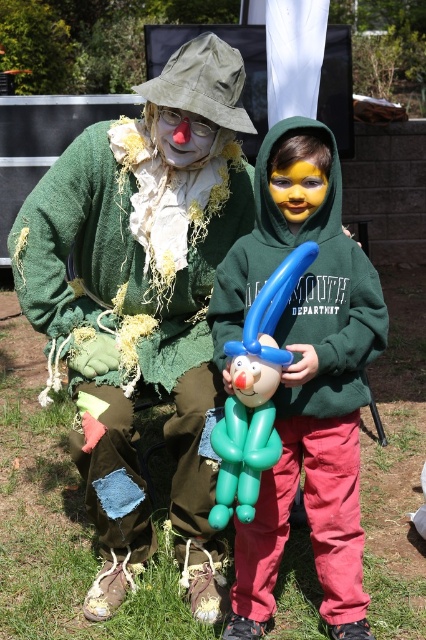
The width and height of the screenshot is (426, 640). In order to click on matte green hoodie at center in this screenshot , I will do `click(305, 388)`.

Which is in front, point (322, 502) or point (261, 403)?

Point (261, 403)

Consider the image. Measure the distance between point (267, 515) and camera.

Point (267, 515) and camera are 7.77 feet apart.

Identify the location of matte green hoodie at center. The width and height of the screenshot is (426, 640). (305, 388).

Measure the distance between point (x=293, y=417) and camera.

The distance of point (x=293, y=417) from camera is 2.31 meters.

Does point (347, 592) come farther from viewer compared to point (199, 156)?

No, it is not.

Image resolution: width=426 pixels, height=640 pixels. Identify the location of matte green hoodie at center. (305, 388).

Between matte green hoodie at center and yellow matte face at center, which one appears on the left side from the viewer's perspective?

matte green hoodie at center

Measure the distance between matte green hoodie at center and yellow matte face at center.

matte green hoodie at center and yellow matte face at center are 16.44 inches apart from each other.

The image size is (426, 640). I want to click on matte green hoodie at center, so click(x=305, y=388).

Where is `matte green hoodie at center`? Image resolution: width=426 pixels, height=640 pixels. matte green hoodie at center is located at coordinates (305, 388).